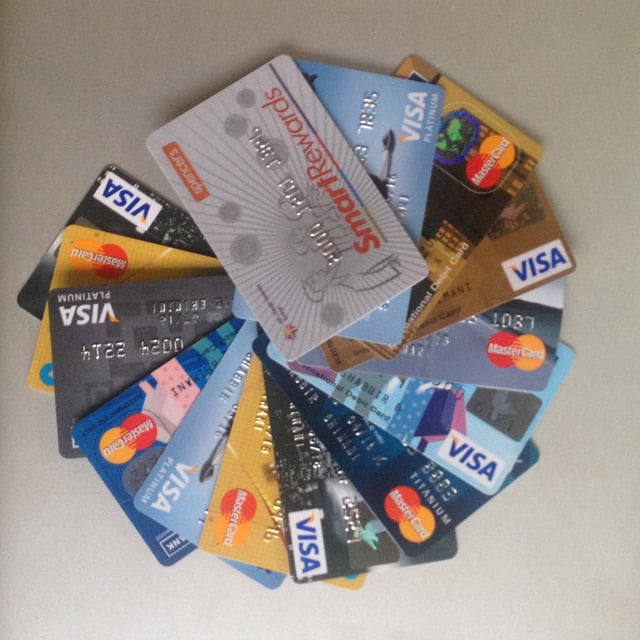
Find the location of a particular element. empty table to the upper right of cards is located at coordinates [596, 107].